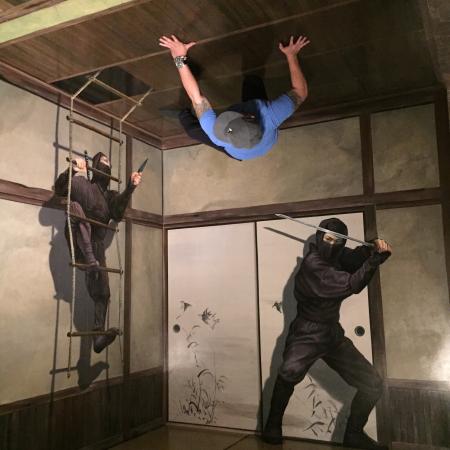
Locate an element on the screen. paneled lower wall is located at coordinates (151, 406), (426, 416).